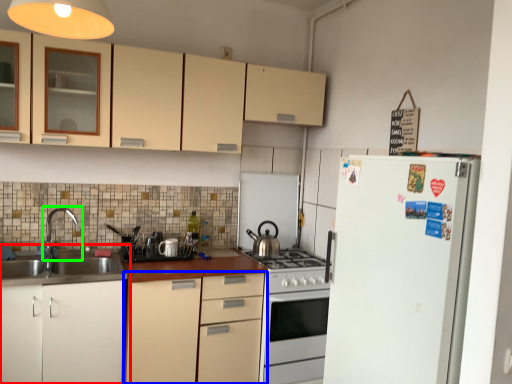
Question: Based on their relative distances, which object is farther from cabinetry (highlighted by a red box)? Choose from cabinetry (highlighted by a blue box) and tap (highlighted by a green box).

Choices:
 (A) cabinetry
 (B) tap

Answer: (B)